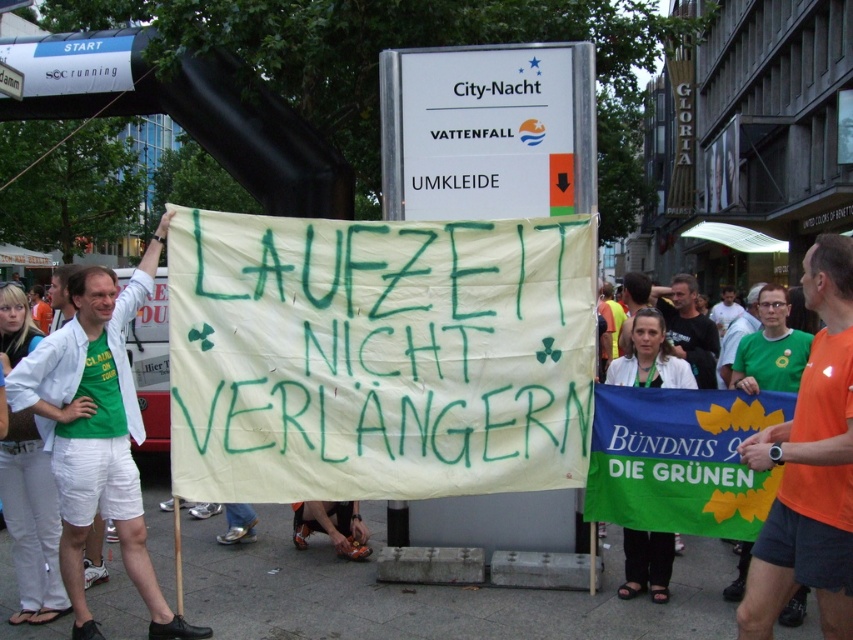
Between matte green t-shirt at center and orange t-shirt at center, which one has more height?

matte green t-shirt at center

Between matte green t-shirt at center and orange t-shirt at center, which one is positioned lower?

matte green t-shirt at center

The width and height of the screenshot is (853, 640). In order to click on matte green t-shirt at center in this screenshot , I will do `click(97, 433)`.

How far apart are green fabric banner at center and orange t-shirt at center?

green fabric banner at center and orange t-shirt at center are 29.60 feet apart from each other.

Between green fabric banner at center and orange t-shirt at center, which one appears on the right side from the viewer's perspective?

orange t-shirt at center

This screenshot has height=640, width=853. I want to click on green fabric banner at center, so click(680, 460).

Is orange fabric shirt at center smaller than orange t-shirt at center?

Yes.

Is orange fabric shirt at center wider than orange t-shirt at center?

In fact, orange fabric shirt at center might be narrower than orange t-shirt at center.

What do you see at coordinates (810, 467) in the screenshot?
I see `orange fabric shirt at center` at bounding box center [810, 467].

Locate an element on the screen. orange fabric shirt at center is located at coordinates (810, 467).